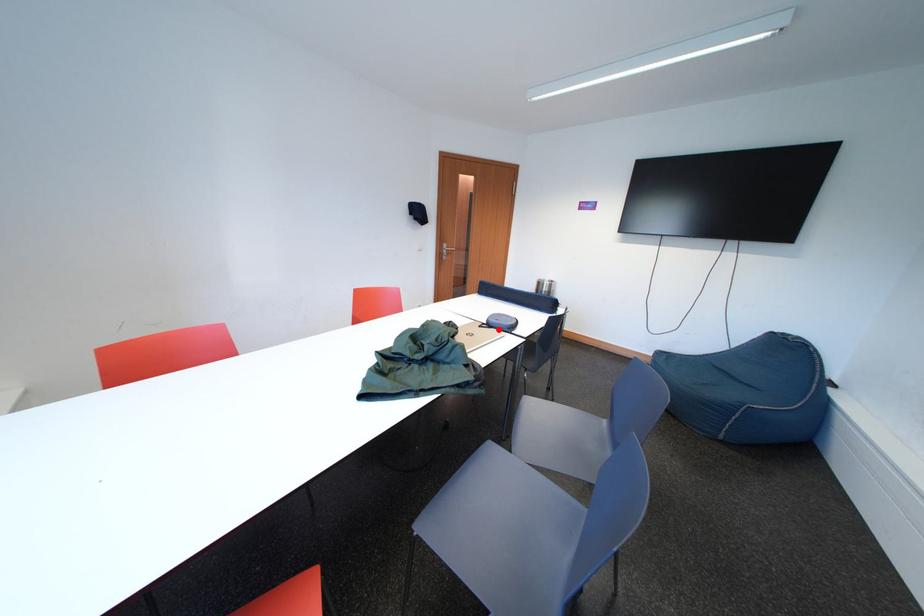
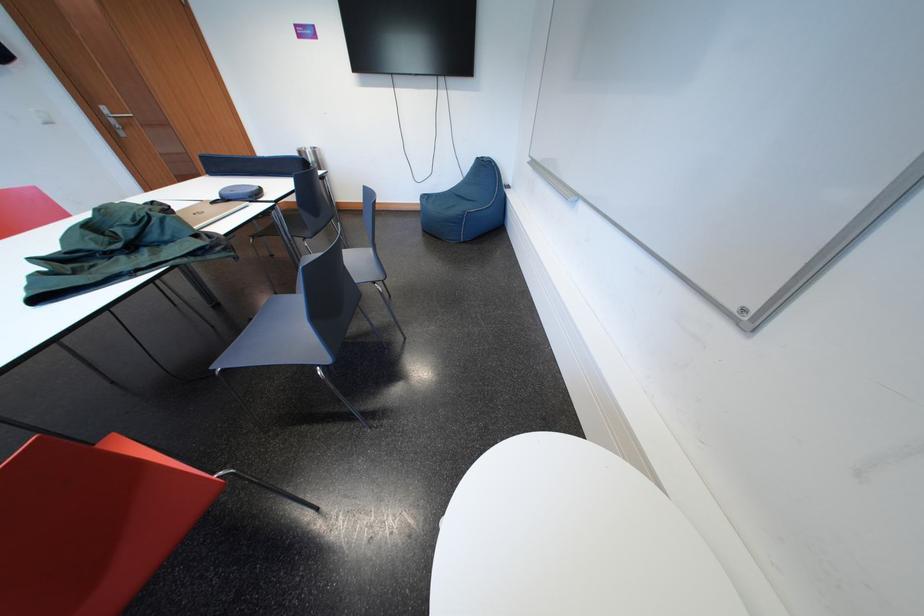
Question: I am providing you with two images of the same scene from different viewpoints. A red point is marked on the first image. Is the red point's position out of view in image 2?

Choices:
 (A) Yes
 (B) No

Answer: (B)